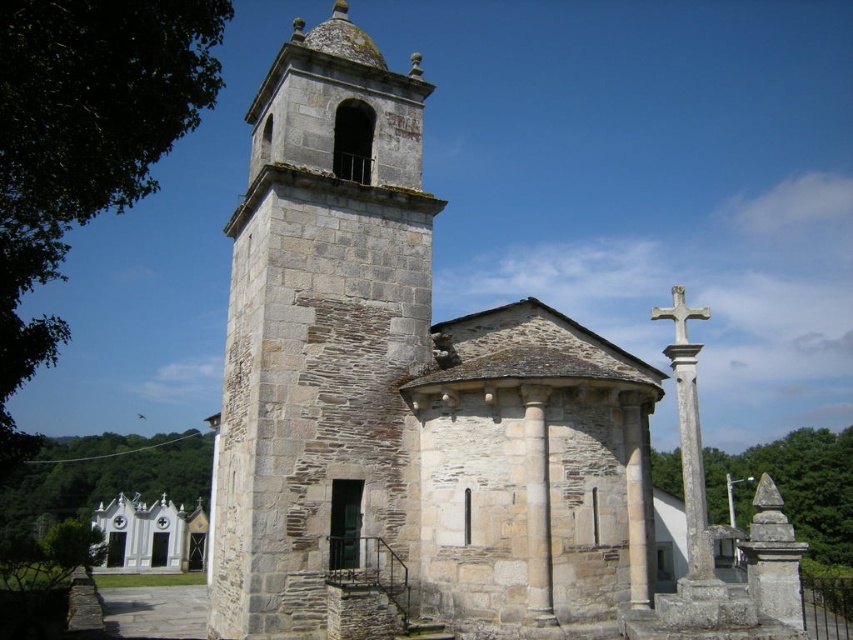
You are standing in the churchyard looking towards the gray stone tower at center and the white painted wood at lower left. Which object is positioned to the right of the other?

The gray stone tower at center is positioned to the right of the white painted wood at lower left.

You are standing in front of the church and want to take a photo that includes both the gray stone tower at center and the white stone cross at upper right. Which object will appear larger in the photo?

The gray stone tower at center will appear larger in the photo because it is closer to the viewer than the white stone cross at upper right.